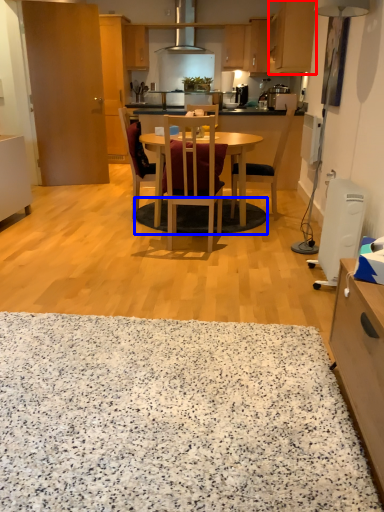
Question: Which object appears farthest to the camera in this image, cabinetry (highlighted by a red box) or mat (highlighted by a blue box)?

Choices:
 (A) cabinetry
 (B) mat

Answer: (A)